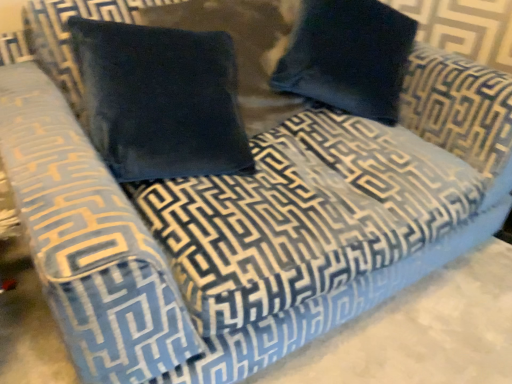
Where is `velvet dark blue pillow at center`? This screenshot has width=512, height=384. velvet dark blue pillow at center is located at coordinates tap(161, 100).

What do you see at coordinates (161, 100) in the screenshot?
I see `velvet dark blue pillow at center` at bounding box center [161, 100].

Where is `velvet dark blue pillow at center`? This screenshot has width=512, height=384. velvet dark blue pillow at center is located at coordinates [161, 100].